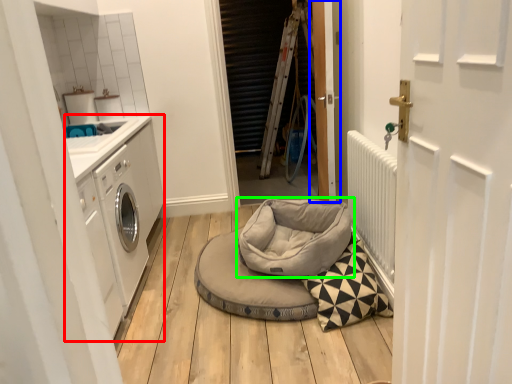
Question: Estimate the real-world distances between objects in this image. Which object is closer to washing machine (highlighted by a red box), door (highlighted by a blue box) or dog bed (highlighted by a green box)?

Choices:
 (A) door
 (B) dog bed

Answer: (B)